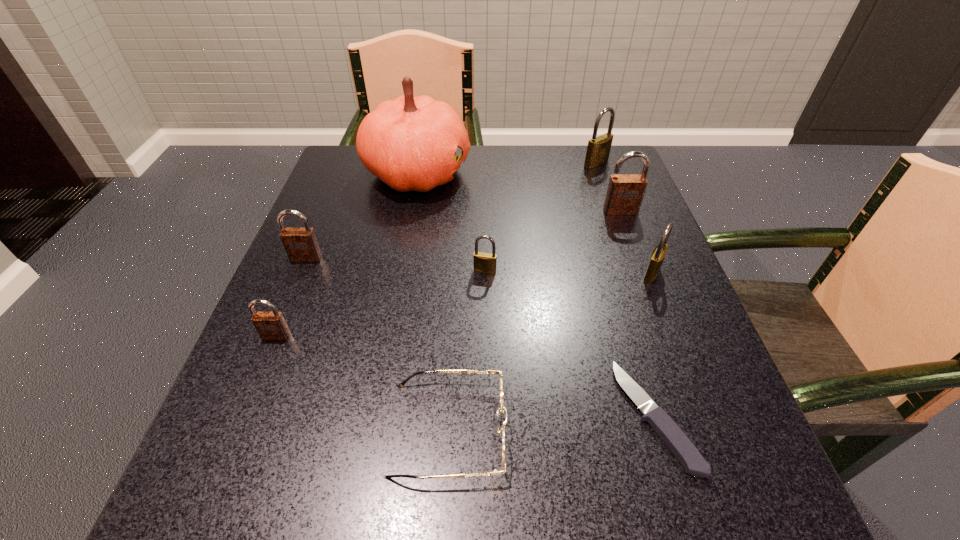
Find the location of `vacant region between the shortest object and the second biggest brown padlock`. vacant region between the shortest object and the second biggest brown padlock is located at coordinates (480, 337).

This screenshot has width=960, height=540. I want to click on the closest object relative to the farthest padlock, so click(x=625, y=192).

Where is `object that is the sixth nearest to the steak knife`? object that is the sixth nearest to the steak knife is located at coordinates (270, 325).

Identify which padlock is located as the fifth nearest to the biggest brass padlock. Please provide its 2D coordinates. Your answer should be formatted as a tuple, i.e. [(x, y)], where the tuple contains the x and y coordinates of a point satisfying the conditions above.

[(270, 325)]

Locate which padlock is the third closest to the pumpkin. Please provide its 2D coordinates. Your answer should be formatted as a tuple, i.e. [(x, y)], where the tuple contains the x and y coordinates of a point satisfying the conditions above.

[(598, 150)]

Select which brass padlock appears as the second closest to the pink pumpkin. Please provide its 2D coordinates. Your answer should be formatted as a tuple, i.e. [(x, y)], where the tuple contains the x and y coordinates of a point satisfying the conditions above.

[(598, 150)]

Identify which brass padlock is the nearest to the second biggest brass padlock. Please provide its 2D coordinates. Your answer should be formatted as a tuple, i.e. [(x, y)], where the tuple contains the x and y coordinates of a point satisfying the conditions above.

[(485, 263)]

Image resolution: width=960 pixels, height=540 pixels. What are the coordinates of `brown padlock that is the second closest one to the biggest brass padlock` in the screenshot? It's located at (300, 243).

Identify which brown padlock is the third nearest to the farthest brass padlock. Please provide its 2D coordinates. Your answer should be formatted as a tuple, i.e. [(x, y)], where the tuple contains the x and y coordinates of a point satisfying the conditions above.

[(270, 325)]

Where is `vacant area in the image that satisfies the following two spatial constraints: 1. on the front side of the smallest brass padlock; 2. on the lenses of the eighth tallest object`? Image resolution: width=960 pixels, height=540 pixels. vacant area in the image that satisfies the following two spatial constraints: 1. on the front side of the smallest brass padlock; 2. on the lenses of the eighth tallest object is located at coordinates pyautogui.click(x=487, y=429).